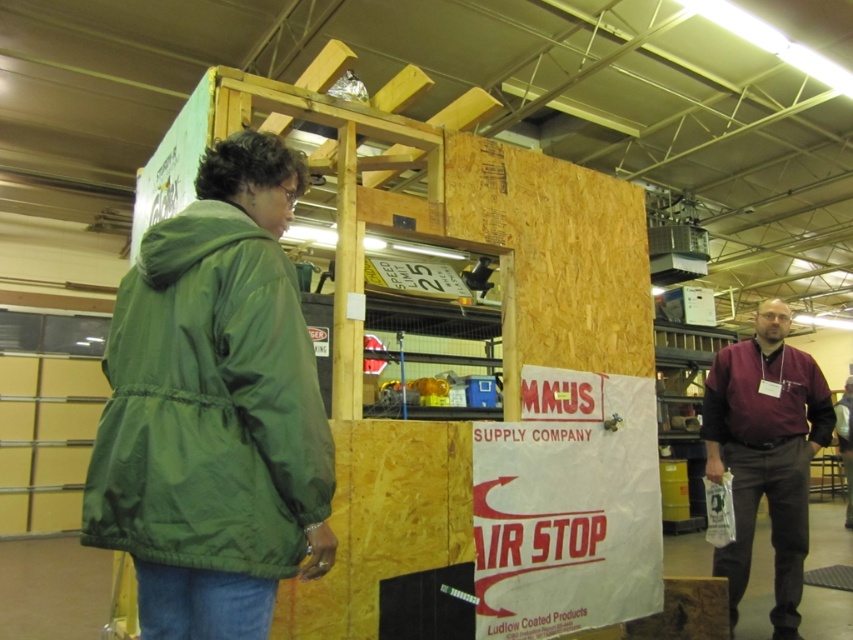
Between point (160, 403) and point (566, 540), which one is positioned behind?

The point (566, 540) is behind.

Who is taller, green nylon jacket at left or white paper sign at center?

white paper sign at center is taller.

Does point (256, 468) come in front of point (590, 499)?

That is True.

The height and width of the screenshot is (640, 853). I want to click on green nylon jacket at left, so (209, 404).

How far apart are white paper sign at center and maroon fabric shirt at right?

white paper sign at center is 28.73 inches away from maroon fabric shirt at right.

Between white paper sign at center and maroon fabric shirt at right, which one is positioned lower?

white paper sign at center is lower down.

Who is more distant from viewer, [573,416] or [759,369]?

Positioned behind is point [759,369].

I want to click on white paper sign at center, so click(x=567, y=506).

Is green nylon jacket at left taller than maroon fabric shirt at right?

Incorrect, green nylon jacket at left's height is not larger of maroon fabric shirt at right's.

Does green nylon jacket at left appear on the right side of maroon fabric shirt at right?

In fact, green nylon jacket at left is to the left of maroon fabric shirt at right.

Between point (189, 355) and point (772, 492), which one is positioned behind?

Point (772, 492)

At what (x,y) coordinates should I click in order to perform the action: click on green nylon jacket at left. Please return your answer as a coordinate pair (x, y). Image resolution: width=853 pixels, height=640 pixels. Looking at the image, I should click on (209, 404).